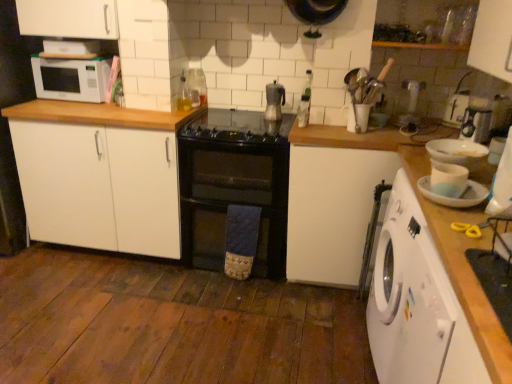
This screenshot has height=384, width=512. I want to click on free space in front of white matte cabinet at left, so click(x=105, y=296).